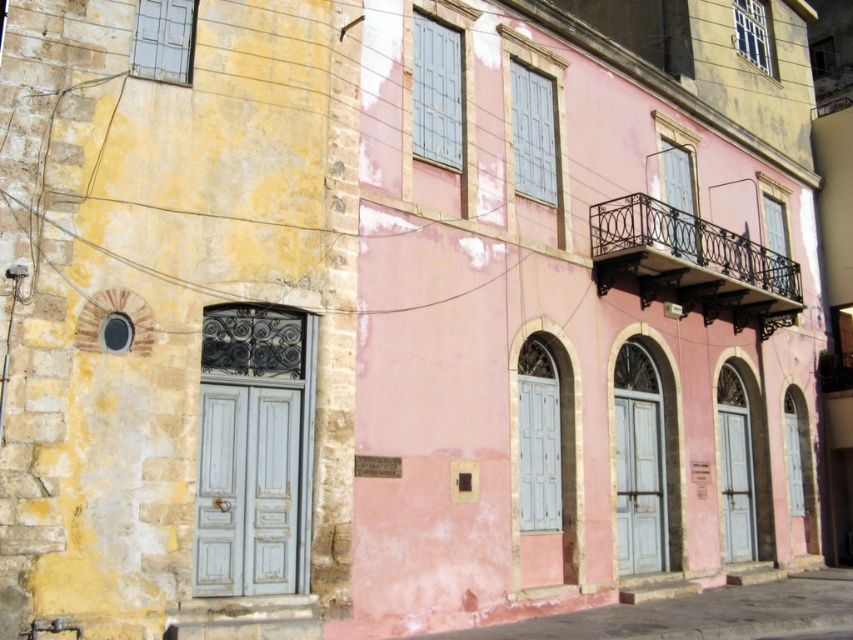
You are standing at point (x=247, y=490) in the image. What object is located exactly at this point?

The distressed white door at left is located exactly at point (x=247, y=490).

You are standing in front of two doors, the matte blue door at center and the matte gray door at lower right. Which door is positioned to the left when facing the buildings?

The matte blue door at center is positioned to the left of the matte gray door at lower right.

Based on the photo, you are a delivery person trying to load a tall package into a van. The package is 2 meters in height. You need to know which door between the distressed white door at left and the matte blue door at center can accommodate the package without tilting it. Which door should you choose?

The matte blue door at center has a greater height than the distressed white door at left, so the package can fit through the matte blue door at center without tilting.